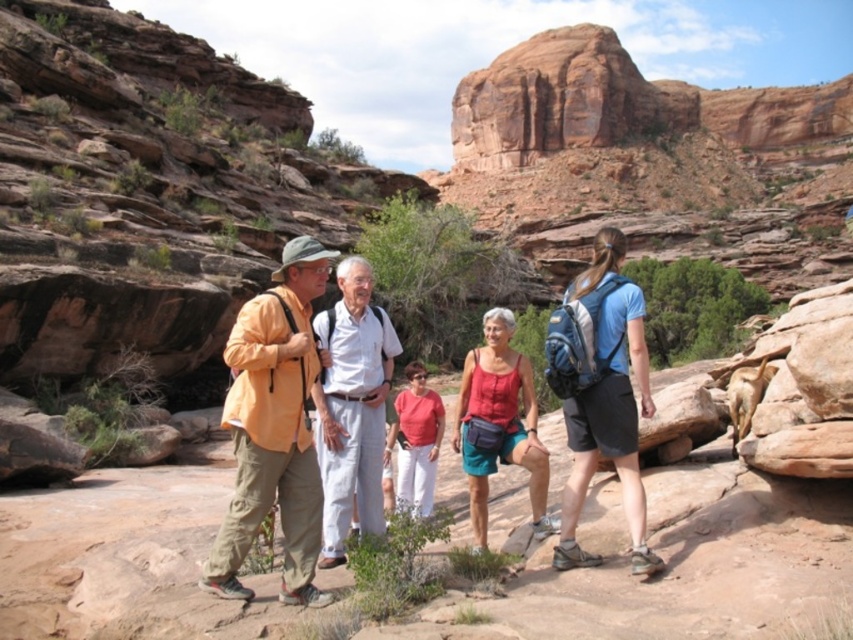
Does reddish-brown rock formation at upper center have a greater width compared to light beige cotton shirt at center?

Yes, reddish-brown rock formation at upper center is wider than light beige cotton shirt at center.

Who is higher up, reddish-brown rock formation at upper center or light beige cotton shirt at center?

reddish-brown rock formation at upper center

Between point (589, 83) and point (386, 396), which one is positioned behind?

The point (589, 83) is behind.

The width and height of the screenshot is (853, 640). Identify the location of reddish-brown rock formation at upper center. (561, 100).

Which is behind, point (558, 132) or point (637, 515)?

The point (558, 132) is more distant.

Can you confirm if reddish-brown rock formation at upper center is shorter than blue fabric backpack at center-right?

No, reddish-brown rock formation at upper center is not shorter than blue fabric backpack at center-right.

What do you see at coordinates (561, 100) in the screenshot?
I see `reddish-brown rock formation at upper center` at bounding box center [561, 100].

Locate an element on the screen. The width and height of the screenshot is (853, 640). reddish-brown rock formation at upper center is located at coordinates (561, 100).

Can you confirm if orange fabric jacket at center is bigger than reddish-brown rock formation at upper center?

Actually, orange fabric jacket at center might be smaller than reddish-brown rock formation at upper center.

Is point (292, 573) positioned behind point (526, 115)?

No, (292, 573) is closer to viewer.

The image size is (853, 640). In order to click on orange fabric jacket at center in this screenshot , I will do `click(274, 428)`.